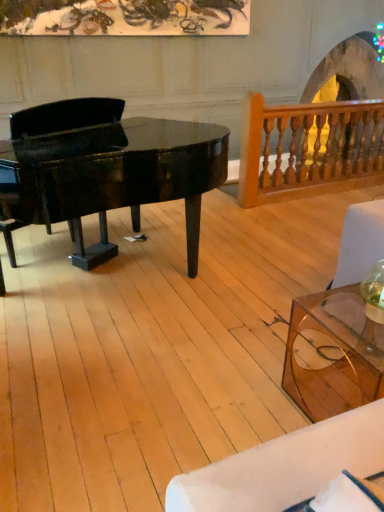
This screenshot has height=512, width=384. Identify the location of unoccupied area in front of glossy black piano at left. (142, 390).